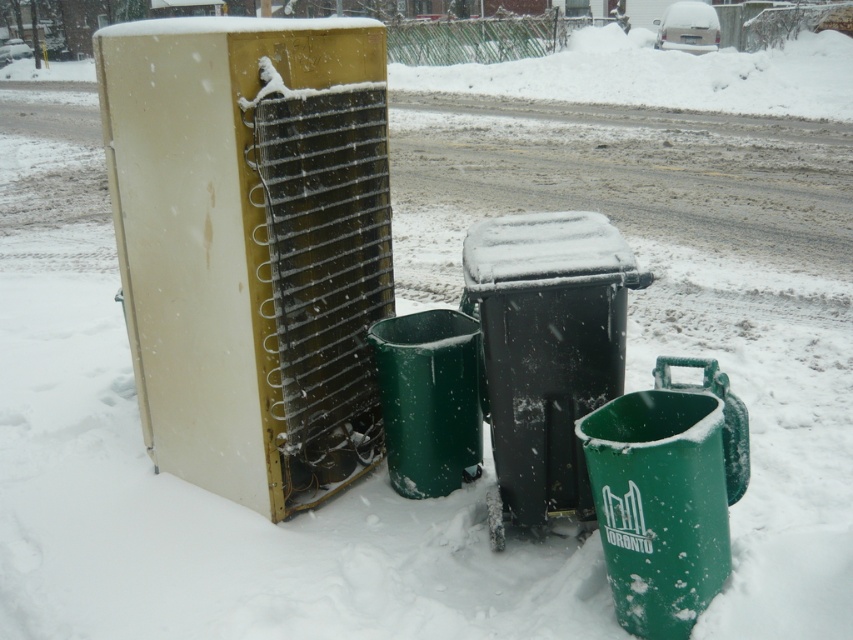
Question: Which object is farther from the camera taking this photo?

Choices:
 (A) green plastic bin at center
 (B) green plastic bin at lower right

Answer: (A)

Question: Is black plastic bin at center further to camera compared to green plastic bin at center?

Choices:
 (A) yes
 (B) no

Answer: (B)

Question: Which point is farther to the camera?

Choices:
 (A) green plastic bin at lower right
 (B) black plastic bin at center
 (C) green plastic bin at center

Answer: (C)

Question: Which object appears farthest from the camera in this image?

Choices:
 (A) green plastic bin at lower right
 (B) green plastic bin at center
 (C) black plastic bin at center

Answer: (B)

Question: Does green plastic bin at lower right lie behind green plastic bin at center?

Choices:
 (A) no
 (B) yes

Answer: (A)

Question: Observing the image, what is the correct spatial positioning of green plastic bin at lower right in reference to green plastic bin at center?

Choices:
 (A) left
 (B) right

Answer: (B)